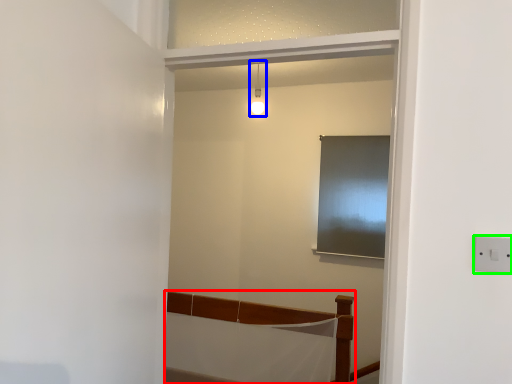
Question: Which object is the closest to the furniture (highlighted by a red box)? Choose among these: light fixture (highlighted by a blue box) or electric outlet (highlighted by a green box).

Choices:
 (A) light fixture
 (B) electric outlet

Answer: (A)